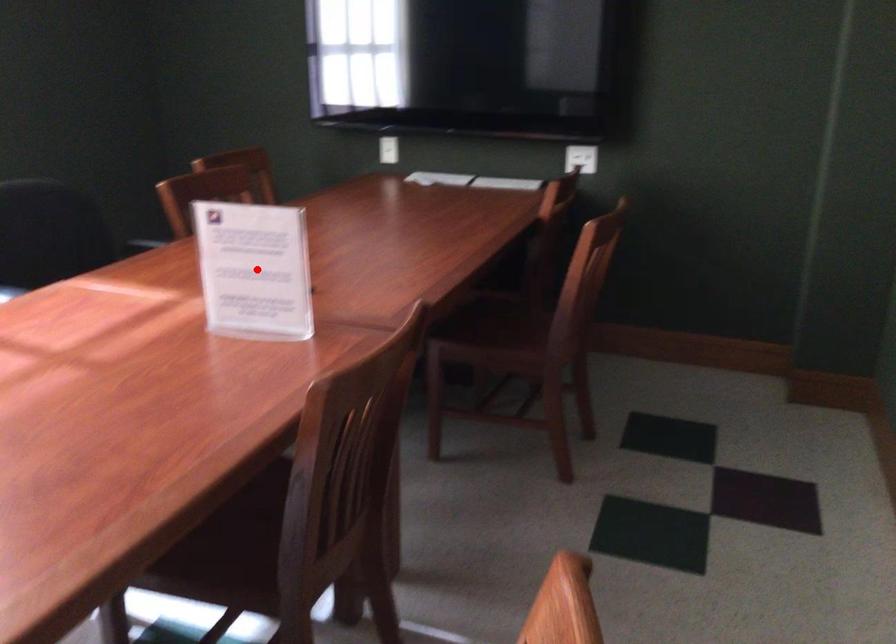
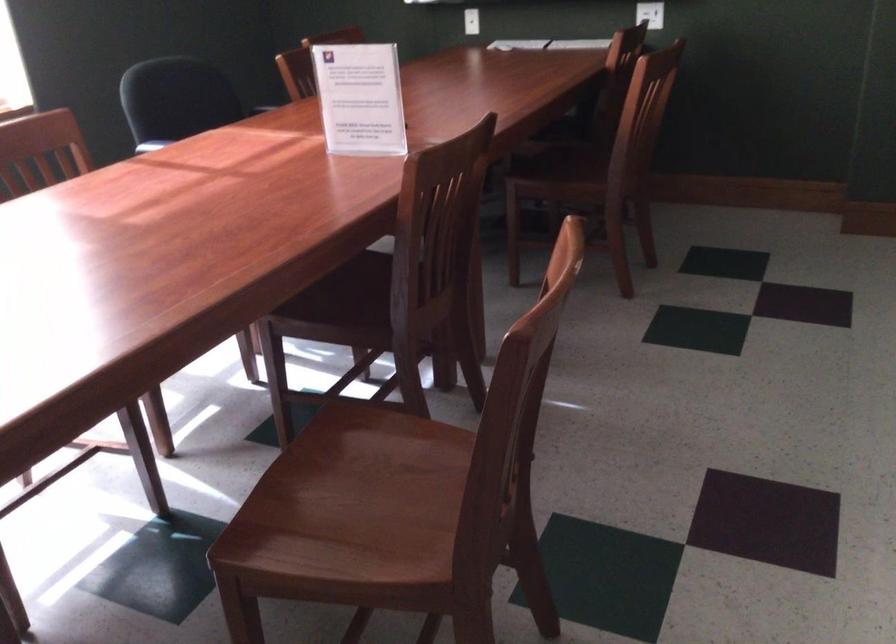
Question: A red point is marked in image1. In image2, is the corresponding 3D point closer to the camera or farther? Reply with the corresponding letter.

Choices:
 (A) The corresponding 3D point is closer.
 (B) The corresponding 3D point is farther.

Answer: (B)